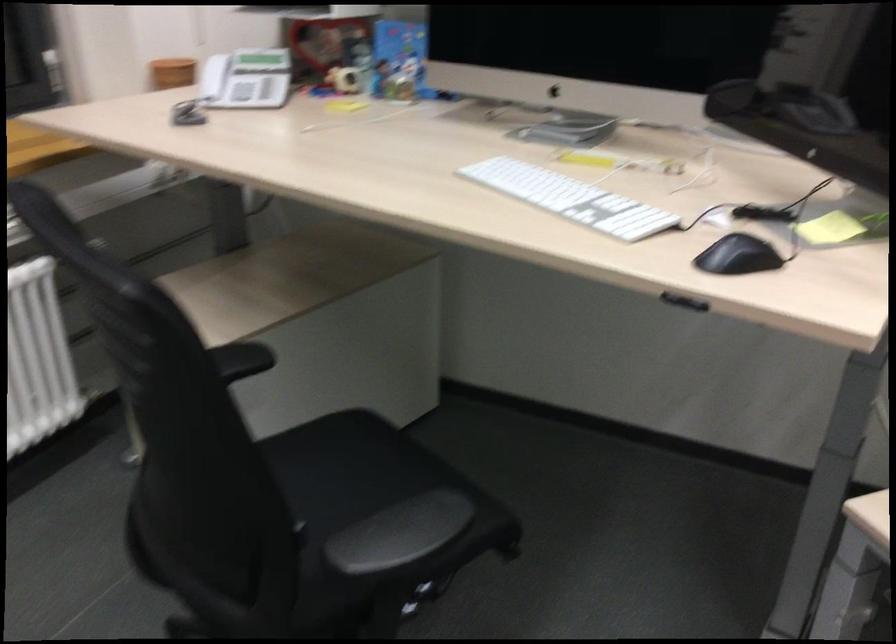
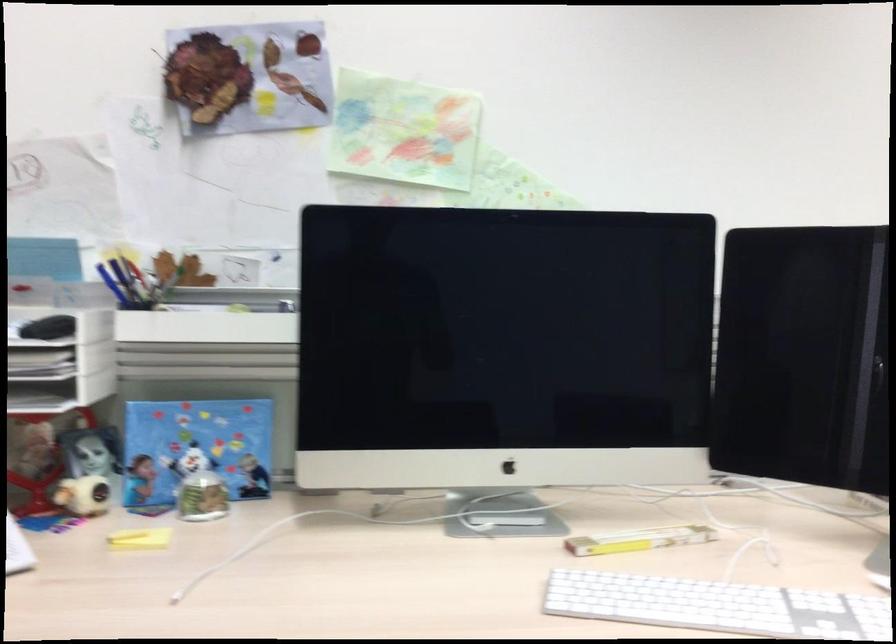
The point at [339,79] is marked in the first image. Where is the corresponding point in the second image?

(83, 495)